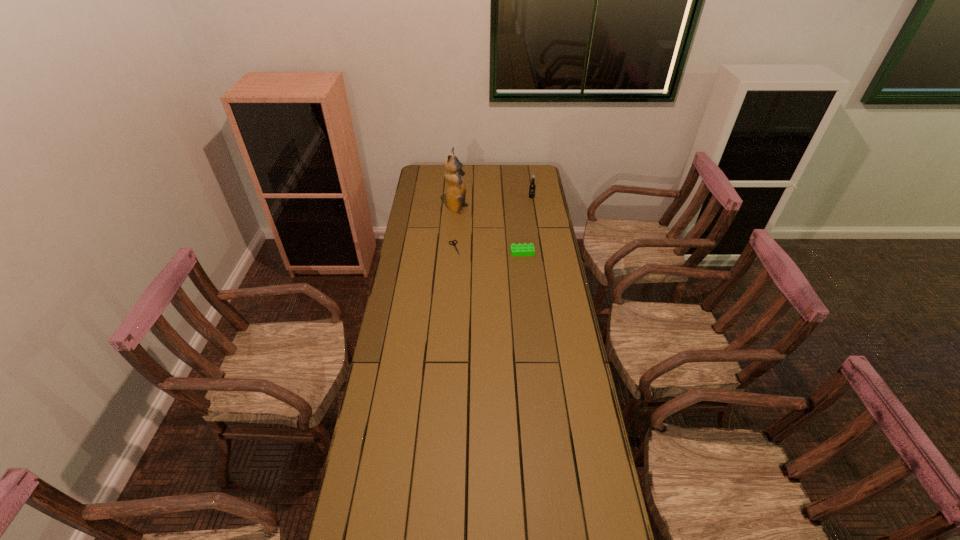
Find the location of a particular element. The image size is (960, 540). free area in between the second farthest object and the farthest object is located at coordinates (494, 204).

Image resolution: width=960 pixels, height=540 pixels. Find the location of `blank region between the tallest object and the shortest object`. blank region between the tallest object and the shortest object is located at coordinates (456, 228).

Where is `blank region between the second tallest object and the second farthest object`? The width and height of the screenshot is (960, 540). blank region between the second tallest object and the second farthest object is located at coordinates (494, 204).

I want to click on vacant area that lies between the shortest object and the third object from left to right, so click(489, 250).

Where is `vacant space that is in between the second shortest object and the shears`? The image size is (960, 540). vacant space that is in between the second shortest object and the shears is located at coordinates (489, 250).

Locate an element on the screen. The width and height of the screenshot is (960, 540). the third closest object to the shears is located at coordinates (532, 186).

Where is `the third closest object to the cat`? This screenshot has width=960, height=540. the third closest object to the cat is located at coordinates [x=519, y=249].

This screenshot has width=960, height=540. I want to click on blank space that satisfies the following two spatial constraints: 1. on the face of the second farthest object; 2. on the right side of the Lego, so click(454, 252).